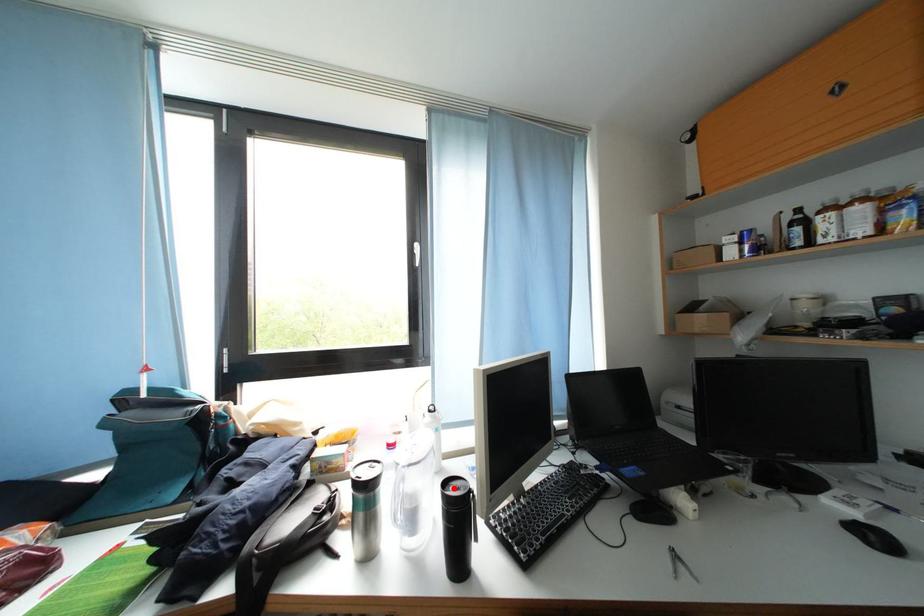
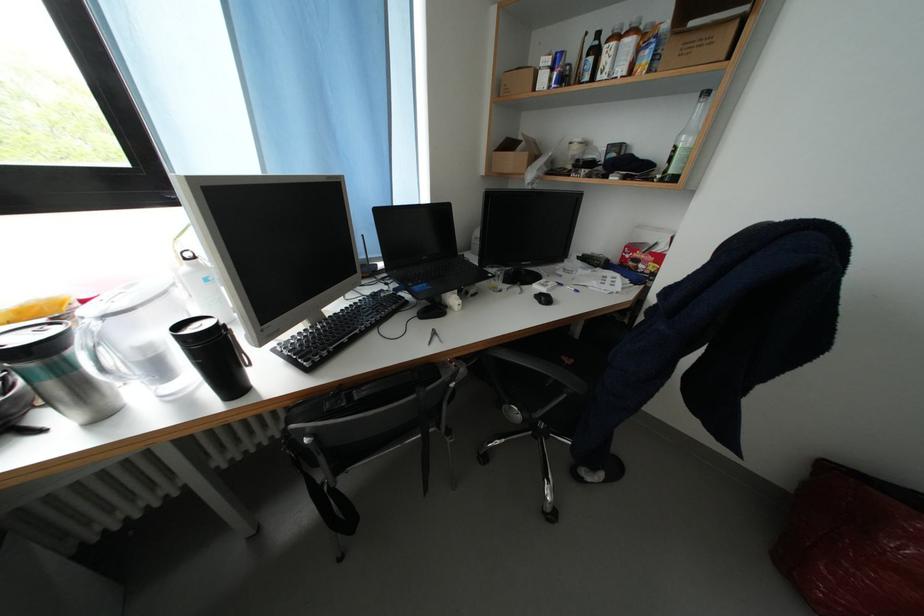
Question: I am providing you with two images of the same scene from different viewpoints. Image1 has a red point marked. In image2, the corresponding 3D location appears at what relative position? Reply with the corresponding letter.

Choices:
 (A) Closer
 (B) Farther

Answer: (B)